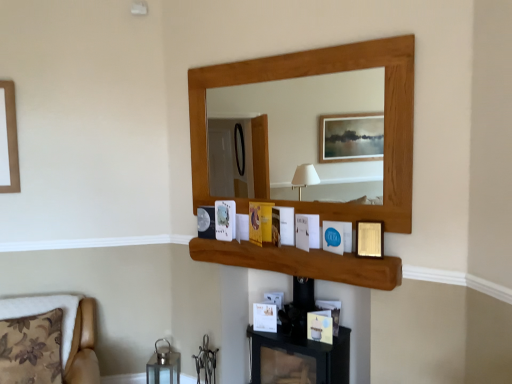
Question: Should I look upward or downward to see blue paper at center, the second picture frame in the right-to-left sequence?

Choices:
 (A) down
 (B) up

Answer: (A)

Question: Should I look upward or downward to see gold metallic picture frame at upper center, the 4th picture frame positioned from the top?

Choices:
 (A) down
 (B) up

Answer: (A)

Question: Is metallic silver picture frame at lower left, which ranks as the 2th picture frame in top-to-bottom order, smaller than wooden shelf at center?

Choices:
 (A) no
 (B) yes

Answer: (B)

Question: Can you confirm if metallic silver picture frame at lower left, which ranks as the 5th picture frame in front-to-back order, is positioned to the left of wooden shelf at center?

Choices:
 (A) yes
 (B) no

Answer: (A)

Question: Can you confirm if metallic silver picture frame at lower left, which ranks as the 2th picture frame in top-to-bottom order, is thinner than wooden shelf at center?

Choices:
 (A) no
 (B) yes

Answer: (B)

Question: From the image's perspective, is metallic silver picture frame at lower left, which is counted as the 1th picture frame, starting from the back, on top of wooden shelf at center?

Choices:
 (A) yes
 (B) no

Answer: (A)

Question: Considering the relative positions of metallic silver picture frame at lower left, which is counted as the 1th picture frame, starting from the back, and wooden shelf at center in the image provided, is metallic silver picture frame at lower left, which is counted as the 1th picture frame, starting from the back, to the right of wooden shelf at center from the viewer's perspective?

Choices:
 (A) yes
 (B) no

Answer: (B)

Question: Considering the relative sizes of metallic silver picture frame at lower left, which ranks as the 5th picture frame in front-to-back order, and wooden shelf at center in the image provided, is metallic silver picture frame at lower left, which ranks as the 5th picture frame in front-to-back order, wider than wooden shelf at center?

Choices:
 (A) no
 (B) yes

Answer: (A)

Question: Could metallic glass lantern at lower left be considered to be inside floral fabric cushion at lower left?

Choices:
 (A) yes
 (B) no

Answer: (B)

Question: Is floral fabric cushion at lower left positioned behind metallic glass lantern at lower left?

Choices:
 (A) no
 (B) yes

Answer: (A)

Question: Can you confirm if floral fabric cushion at lower left is shorter than metallic glass lantern at lower left?

Choices:
 (A) no
 (B) yes

Answer: (A)

Question: Considering the relative sizes of floral fabric cushion at lower left and metallic glass lantern at lower left in the image provided, is floral fabric cushion at lower left bigger than metallic glass lantern at lower left?

Choices:
 (A) yes
 (B) no

Answer: (A)

Question: From a real-world perspective, is floral fabric cushion at lower left below metallic glass lantern at lower left?

Choices:
 (A) yes
 (B) no

Answer: (B)

Question: Is floral fabric cushion at lower left facing towards metallic glass lantern at lower left?

Choices:
 (A) yes
 (B) no

Answer: (B)

Question: From the image's perspective, is gold metallic picture frame at upper center, arranged as the 1th picture frame when viewed from the right, over wooden shelf at center?

Choices:
 (A) yes
 (B) no

Answer: (A)